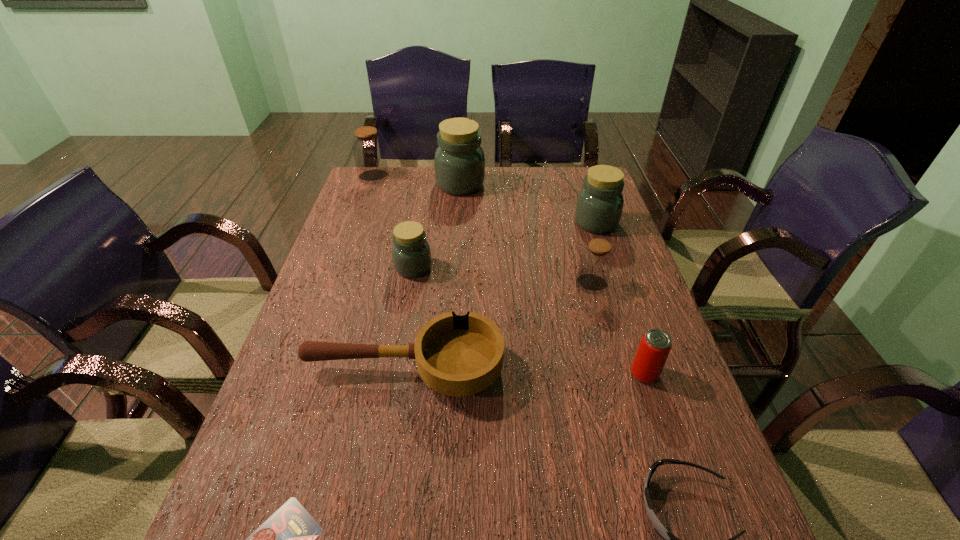
This screenshot has width=960, height=540. What are the coordinates of `vacant point located between the biggest green jar and the third shortest object` in the screenshot? It's located at (432, 277).

Locate an element on the screen. free area in between the smallest green jar and the beer can is located at coordinates (529, 321).

Choose which object is the fourth nearest neighbor to the pink beer can. Please provide its 2D coordinates. Your answer should be formatted as a tuple, i.e. [(x, y)], where the tuple contains the x and y coordinates of a point satisfying the conditions above.

[(599, 206)]

Identify which object is located as the second nearest to the bigger brown jar. Please provide its 2D coordinates. Your answer should be formatted as a tuple, i.e. [(x, y)], where the tuple contains the x and y coordinates of a point satisfying the conditions above.

[(411, 254)]

Locate which jar is the second closest to the second shortest object. Please provide its 2D coordinates. Your answer should be formatted as a tuple, i.e. [(x, y)], where the tuple contains the x and y coordinates of a point satisfying the conditions above.

[(411, 254)]

Identify which jar is located as the second nearest to the smallest green jar. Please provide its 2D coordinates. Your answer should be formatted as a tuple, i.e. [(x, y)], where the tuple contains the x and y coordinates of a point satisfying the conditions above.

[(596, 261)]

Select which green jar is the closest to the saucepan. Please provide its 2D coordinates. Your answer should be formatted as a tuple, i.e. [(x, y)], where the tuple contains the x and y coordinates of a point satisfying the conditions above.

[(411, 254)]

Identify the location of green jar that stands as the third closest to the nearer brown jar. The image size is (960, 540). (459, 163).

Image resolution: width=960 pixels, height=540 pixels. In order to click on vacant region that satisfies the following two spatial constraints: 1. with the handle on the side of the seventh tallest object; 2. on the left side of the nearer brown jar in this screenshot , I will do `click(418, 284)`.

This screenshot has height=540, width=960. What are the coordinates of `free space that satisfies the following two spatial constraints: 1. with the handle on the side of the third shortest object; 2. on the front side of the nearest green jar` in the screenshot? It's located at (420, 267).